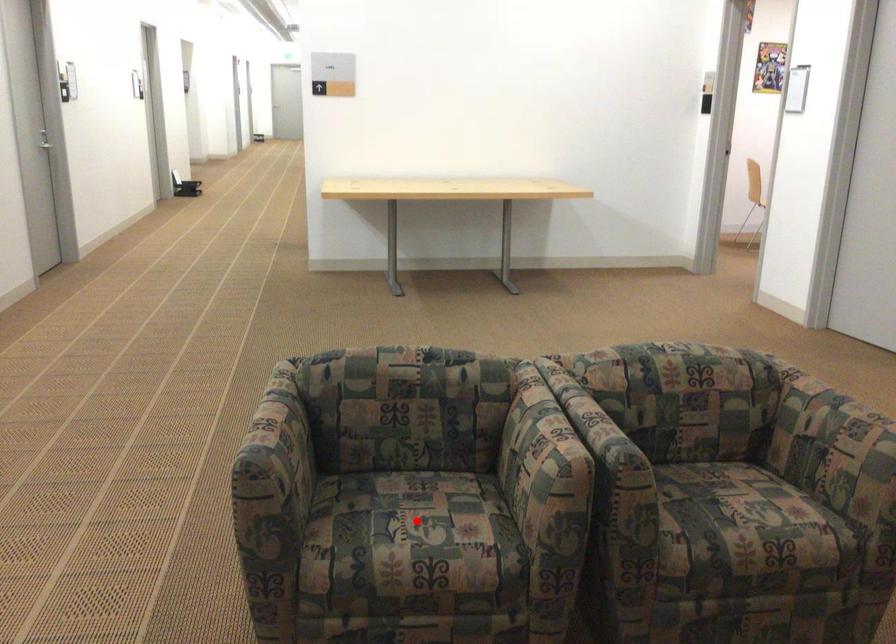
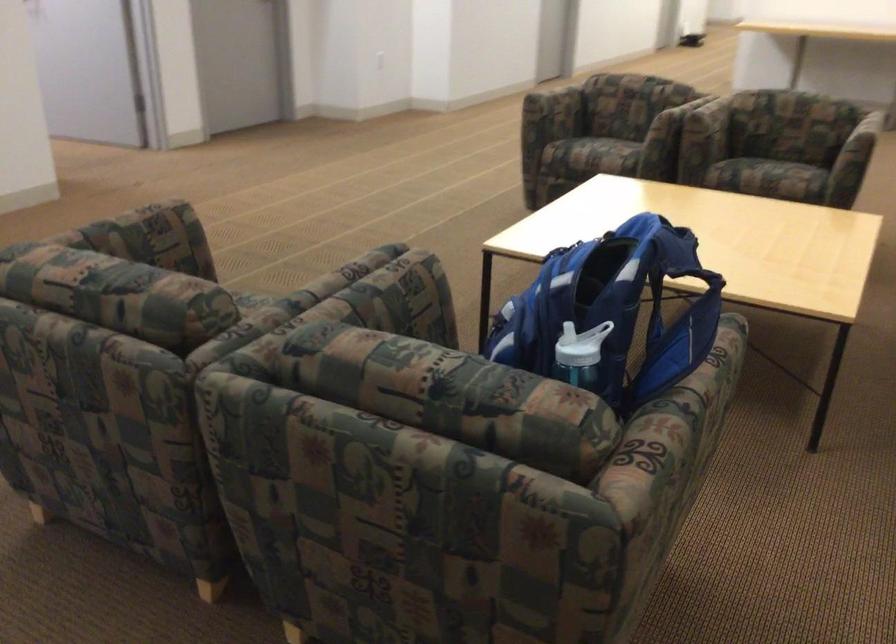
Question: I am providing you with two images of the same scene from different viewpoints. A red point is marked on the first image. At the location where the point appears in image 1, is it still visible in image 2?

Choices:
 (A) Yes
 (B) No

Answer: (B)